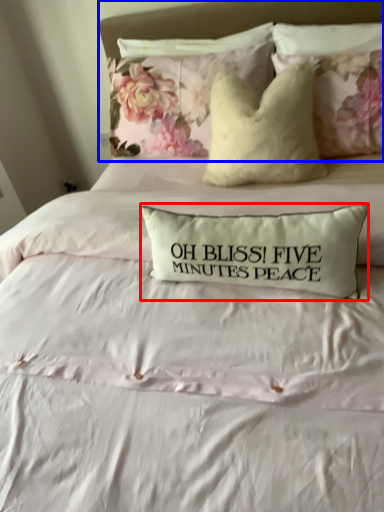
Question: Among these objects, which one is farthest to the camera, pillow (highlighted by a red box) or headboard (highlighted by a blue box)?

Choices:
 (A) pillow
 (B) headboard

Answer: (B)